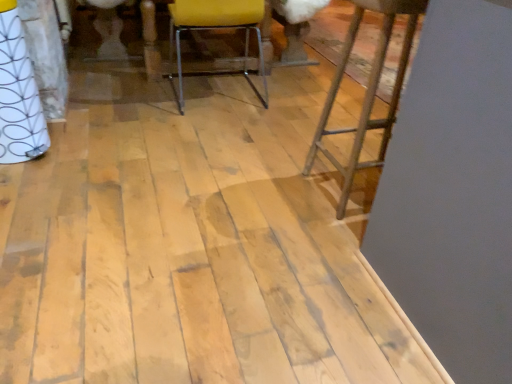
You are a GUI agent. You are given a task and a screenshot of the screen. Output one action in this format:
    pyautogui.click(x=<x>, y=<y>)
    Task: Click on the free space behind rustic wood stool at right
    Image resolution: width=512 pixels, height=384 pixels.
    Given the screenshot: What is the action you would take?
    (325, 148)